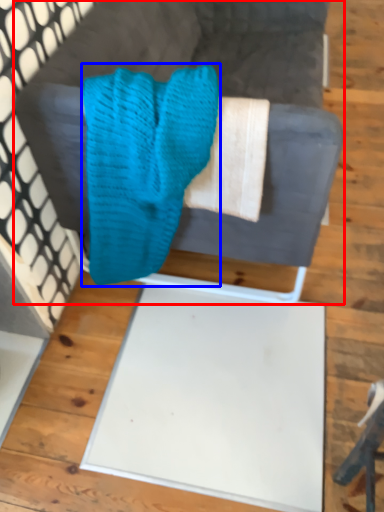
Question: Which object is further to the camera taking this photo, furniture (highlighted by a red box) or scrub (highlighted by a blue box)?

Choices:
 (A) furniture
 (B) scrub

Answer: (A)